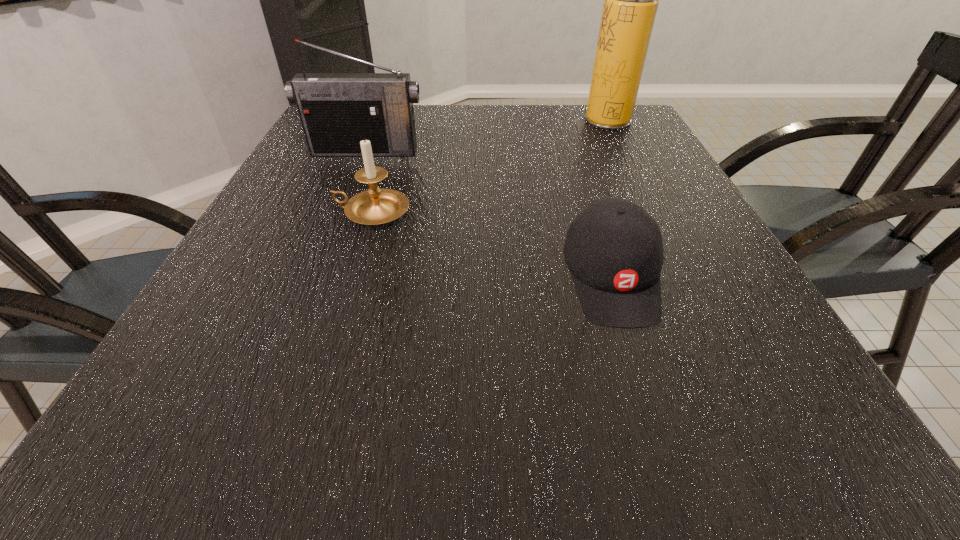
Locate an element on the screen. This screenshot has height=540, width=960. free region located 0.120m with a handle on the side of the candle holder is located at coordinates (276, 212).

At what (x,y) coordinates should I click in order to perform the action: click on vacant area situated 0.060m with a handle on the side of the candle holder. Please return your answer as a coordinate pair (x, y). This screenshot has width=960, height=540. Looking at the image, I should click on (305, 212).

At what (x,y) coordinates should I click in order to perform the action: click on vacant area situated 0.150m with a handle on the side of the candle holder. Please return your answer as a coordinate pair (x, y). Looking at the image, I should click on (262, 212).

Where is `vacant area situated with a logo on the front of the shortest object`? The image size is (960, 540). vacant area situated with a logo on the front of the shortest object is located at coordinates (659, 431).

Find the location of a particular element. This screenshot has width=960, height=540. object present at the far edge is located at coordinates (631, 0).

Find the location of a particular element. radio receiver situated at the left edge is located at coordinates (337, 110).

Locate an element on the screen. The width and height of the screenshot is (960, 540). candle holder at the left edge is located at coordinates (375, 206).

The width and height of the screenshot is (960, 540). Identify the location of aerosol can present at the right edge. (631, 0).

Where is `baseball cap that is at the right edge`? baseball cap that is at the right edge is located at coordinates (x=613, y=248).

Find the location of a particular element. This screenshot has width=960, height=540. object positioned at the far right corner is located at coordinates (631, 0).